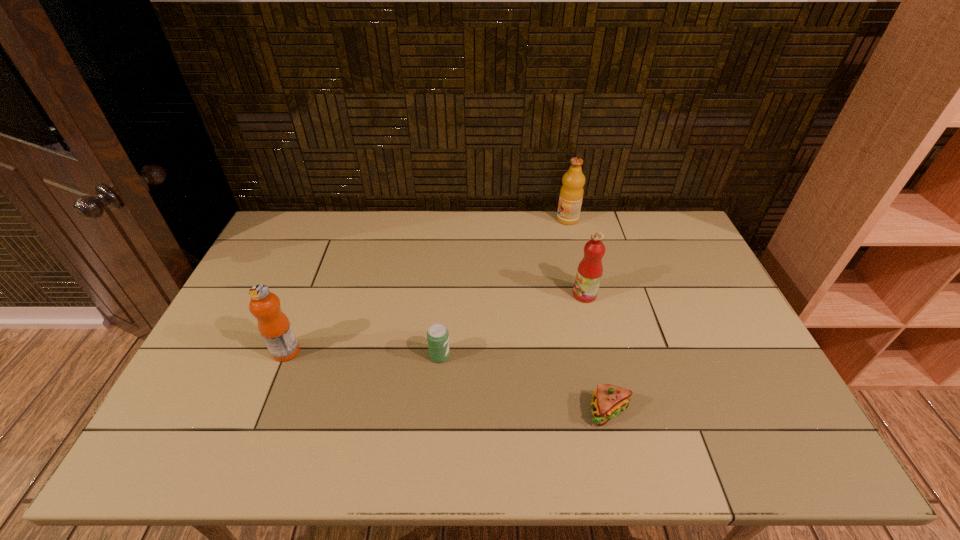
Identify the location of vacant space located on the front label of the second farthest fruit juice. The height and width of the screenshot is (540, 960). (450, 295).

Where is `free space located 0.190m on the front label of the second farthest fruit juice`? free space located 0.190m on the front label of the second farthest fruit juice is located at coordinates (512, 295).

Image resolution: width=960 pixels, height=540 pixels. Find the location of `vacant area situated 0.320m on the front label of the second farthest fruit juice`. vacant area situated 0.320m on the front label of the second farthest fruit juice is located at coordinates (469, 295).

Where is `vacant area located on the front of the fourth object from right to left`? This screenshot has height=540, width=960. vacant area located on the front of the fourth object from right to left is located at coordinates (432, 448).

Locate an element on the screen. The width and height of the screenshot is (960, 540). free space located on the left of the sandwich is located at coordinates (465, 411).

Locate an element on the screen. object at the far edge is located at coordinates (571, 194).

Identify the location of object that is at the near edge. (609, 400).

Where is `vacant space at the far edge`? Image resolution: width=960 pixels, height=540 pixels. vacant space at the far edge is located at coordinates (376, 232).

This screenshot has width=960, height=540. What are the coordinates of `free region at the left edge` in the screenshot? It's located at (225, 423).

Where is `free space at the right edge of the desktop`? free space at the right edge of the desktop is located at coordinates (678, 274).